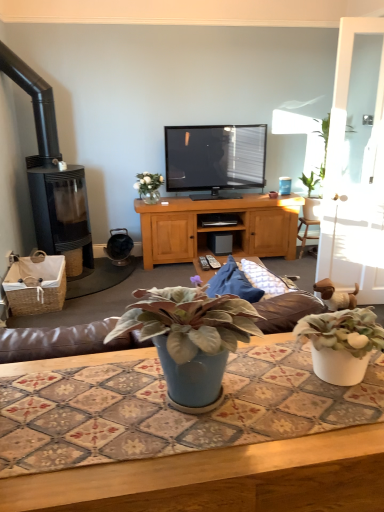
Question: Considering the relative sizes of blue ceramic table at center and black glass fireplace at left in the image provided, is blue ceramic table at center thinner than black glass fireplace at left?

Choices:
 (A) yes
 (B) no

Answer: (B)

Question: Is blue ceramic table at center outside black glass fireplace at left?

Choices:
 (A) no
 (B) yes

Answer: (B)

Question: Does blue ceramic table at center turn towards black glass fireplace at left?

Choices:
 (A) no
 (B) yes

Answer: (B)

Question: Does blue ceramic table at center contain black glass fireplace at left?

Choices:
 (A) no
 (B) yes

Answer: (A)

Question: Is blue ceramic table at center shorter than black glass fireplace at left?

Choices:
 (A) no
 (B) yes

Answer: (B)

Question: Is white plastic remote control at center, which is the second remote control from left to right, taller or shorter than translucent glass vase at upper center?

Choices:
 (A) tall
 (B) short

Answer: (B)

Question: Which is correct: white plastic remote control at center, positioned as the first remote control in right-to-left order, is inside translucent glass vase at upper center, or outside of it?

Choices:
 (A) inside
 (B) outside

Answer: (B)

Question: From the image's perspective, is white plastic remote control at center, positioned as the first remote control in right-to-left order, positioned above or below translucent glass vase at upper center?

Choices:
 (A) above
 (B) below

Answer: (B)

Question: Is white plastic remote control at center, positioned as the first remote control in right-to-left order, to the left or to the right of translucent glass vase at upper center in the image?

Choices:
 (A) left
 (B) right

Answer: (B)

Question: From the image's perspective, is white plastic remote control at center, positioned as the first remote control in right-to-left order, located above or below white glass door at right?

Choices:
 (A) below
 (B) above

Answer: (A)

Question: In terms of height, does white plastic remote control at center, which is the second remote control from left to right, look taller or shorter compared to white glass door at right?

Choices:
 (A) tall
 (B) short

Answer: (B)

Question: From a real-world perspective, is white plastic remote control at center, positioned as the first remote control in right-to-left order, physically located above or below white glass door at right?

Choices:
 (A) below
 (B) above

Answer: (A)

Question: Is white plastic remote control at center, which is the second remote control from left to right, spatially inside white glass door at right, or outside of it?

Choices:
 (A) inside
 (B) outside

Answer: (B)

Question: Is point (24, 261) positioned closer to the camera than point (173, 397)?

Choices:
 (A) closer
 (B) farther

Answer: (B)

Question: Considering the positions of woven brown picnic basket at lower left and blue matte plant pot at center, the first houseplant when ordered from front to back, in the image, is woven brown picnic basket at lower left wider or thinner than blue matte plant pot at center, the first houseplant when ordered from front to back,?

Choices:
 (A) wide
 (B) thin

Answer: (A)